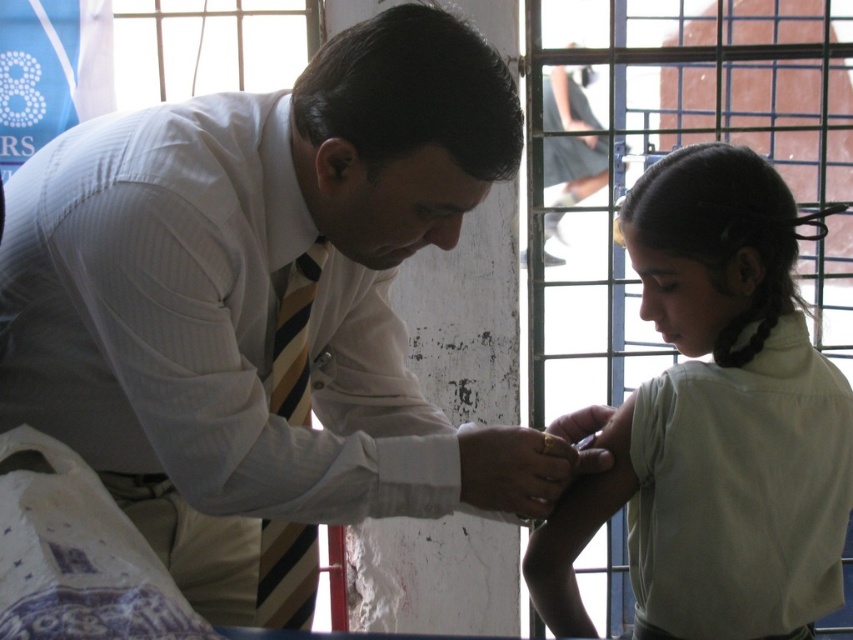
The image size is (853, 640). What are the coordinates of `striped fabric tie at left` in the screenshot? It's located at (294, 337).

Does point (283, 355) lie behind point (512, 428)?

Yes, point (283, 355) is farther from viewer.

Between point (271, 371) and point (479, 449), which one is positioned behind?

The point (271, 371) is more distant.

The image size is (853, 640). In order to click on striped fabric tie at left in this screenshot , I will do `click(294, 337)`.

Is point (166, 268) positioned behind point (810, 614)?

That is False.

Is white striped shirt at center smaller than light beige shirt at right?

Incorrect, white striped shirt at center is not smaller in size than light beige shirt at right.

Measure the distance between point (x=201, y=529) and camera.

Point (x=201, y=529) is 1.95 meters from camera.

Where is `white striped shirt at center`? white striped shirt at center is located at coordinates (254, 300).

Who is lower down, white striped shirt at center or striped fabric tie at left?

Positioned lower is striped fabric tie at left.

Between white striped shirt at center and striped fabric tie at left, which one is positioned higher?

Positioned higher is white striped shirt at center.

Who is more forward, [584,461] or [273,541]?

Point [273,541] is more forward.

This screenshot has width=853, height=640. I want to click on white striped shirt at center, so click(254, 300).